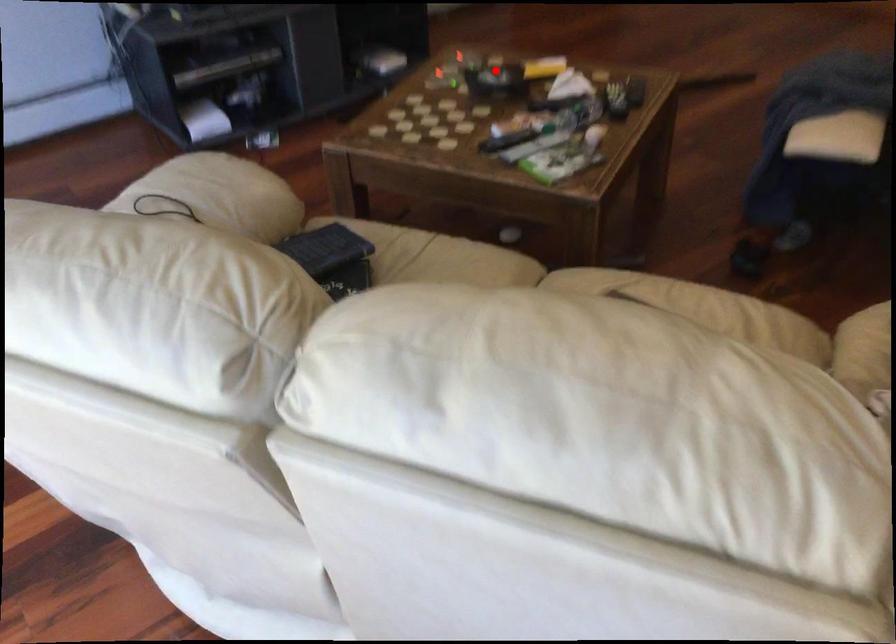
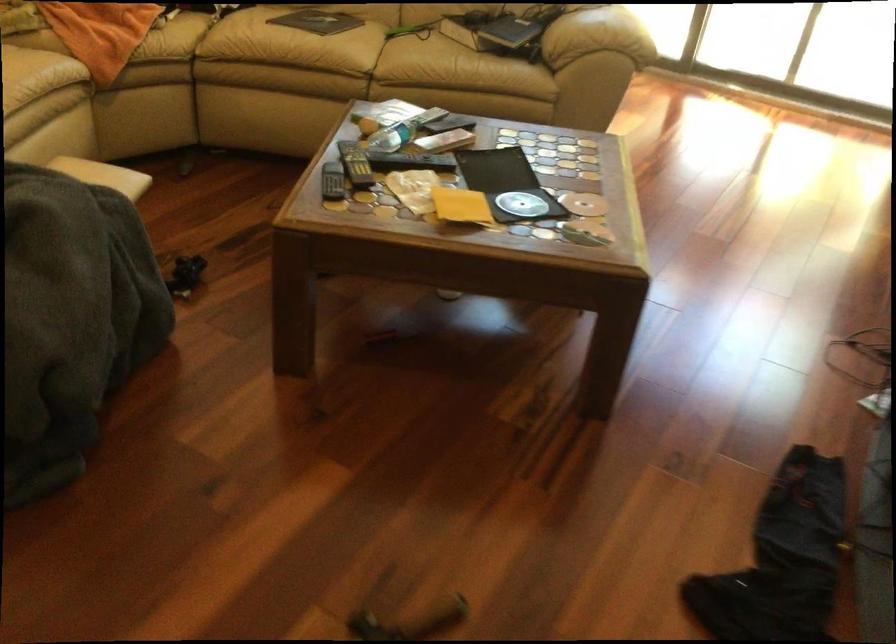
Question: I am providing you with two images of the same scene from different viewpoints. In image1, a red point is highlighted. Considering the same 3D point in image2, which of the following is correct?

Choices:
 (A) It is closer
 (B) It is farther

Answer: (A)